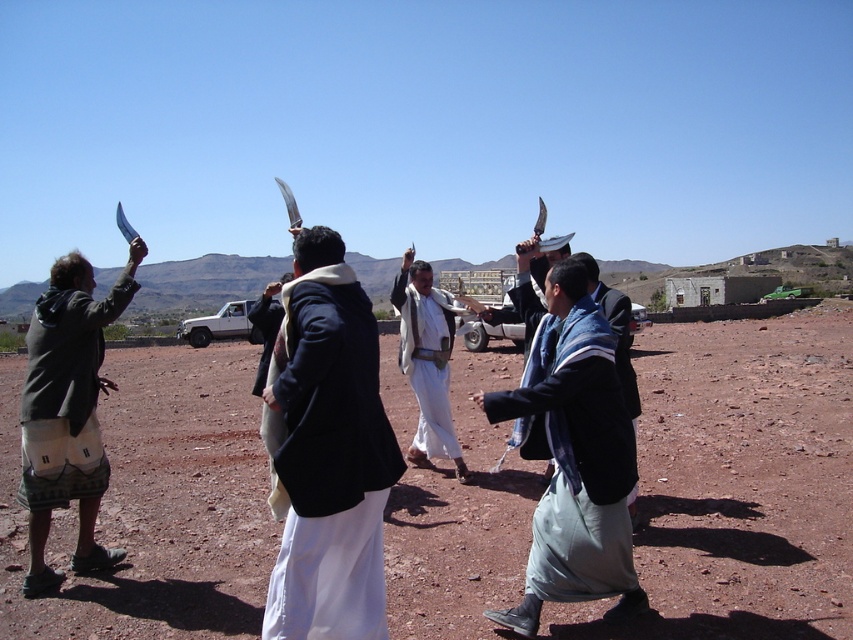
You are a photographer trying to capture a photo of the dirt field at center and the light blue fabric at center. Which object should you focus on first to ensure both are in the frame?

The light blue fabric at center is behind the dirt field at center, so you should focus on the dirt field at center first to ensure both are in the frame.

You are standing in the desert scene and want to place a small flag at the point closer to the camera between point (225, 433) and point (283, 500). Which point should you choose?

You should choose point (225, 433) because it is further to the camera than point (283, 500), making it the closer point to place the flag.

You are a photographer planning to capture a wide shot of the dirt field at center and the light blue fabric at center. Given their sizes, which object would require you to step back further to fully include in the frame?

The dirt field at center has a greater width than the light blue fabric at center, so you would need to step back further to fully capture the dirt field at center in the frame.